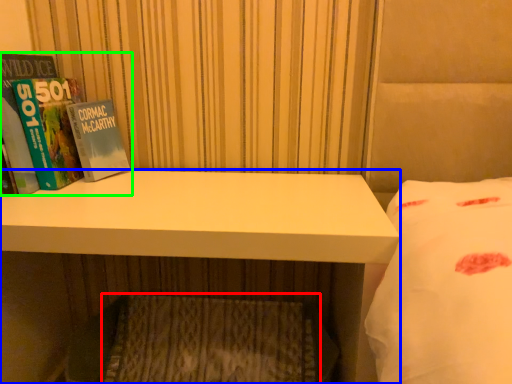
Question: Considering the real-world distances, which object is closest to mattress (highlighted by a red box)? desk (highlighted by a blue box) or book (highlighted by a green box).

Choices:
 (A) desk
 (B) book

Answer: (A)